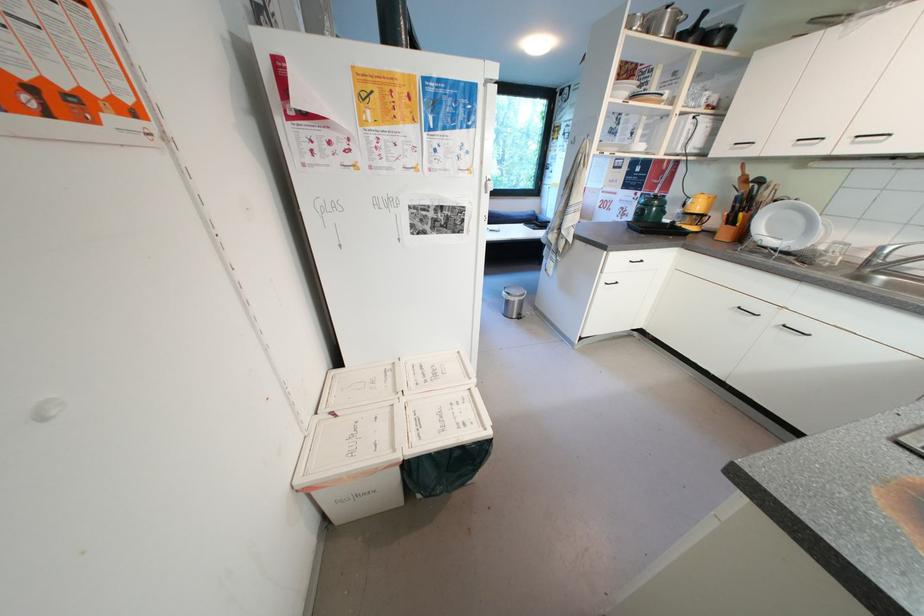
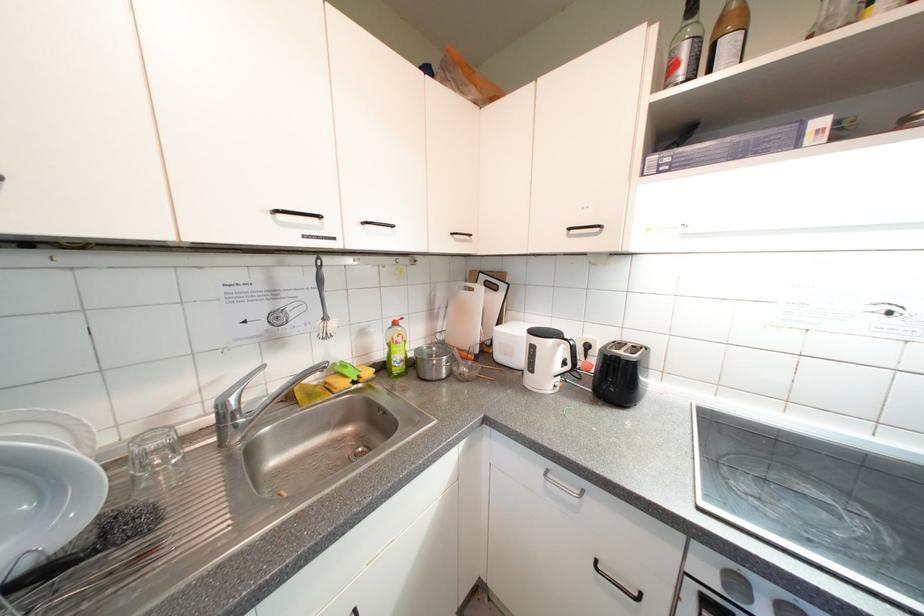
Locate, in the second image, the point that corresponds to point 883,257 in the first image.

(233, 419)